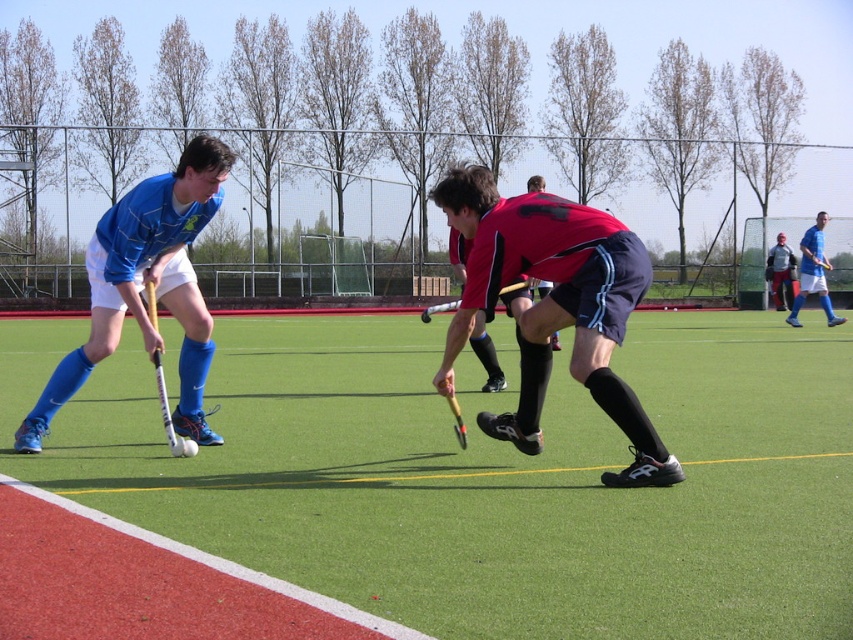
Question: Does blue jersey at center lie in front of dark gray fabric jacket at upper right?

Choices:
 (A) no
 (B) yes

Answer: (B)

Question: Is matte blue jersey at left wider than blue jersey at center?

Choices:
 (A) no
 (B) yes

Answer: (B)

Question: Which point is farther from the camera taking this photo?

Choices:
 (A) (811, 240)
 (B) (97, 310)
 (C) (437, 307)

Answer: (A)

Question: Which of the following is the farthest from the observer?

Choices:
 (A) (453, 304)
 (B) (151, 284)
 (C) (103, 269)

Answer: (A)

Question: Which of these objects is positioned farthest from the matte blue jersey at left?

Choices:
 (A) green artificial turf at center
 (B) white glossy hockey stick at left
 (C) blue jersey at center
 (D) wooden hockey stick at center

Answer: (C)

Question: Is matte red shorts at center to the left of matte blue jersey at left from the viewer's perspective?

Choices:
 (A) yes
 (B) no

Answer: (B)